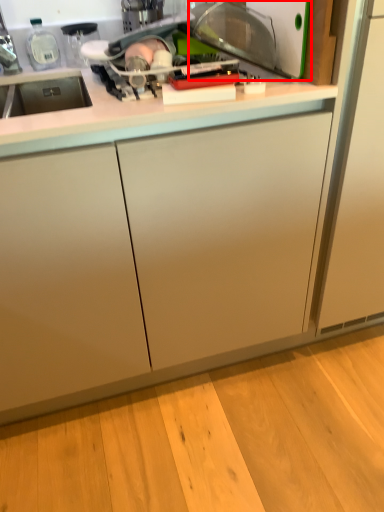
Question: From the image's perspective, considering the relative positions of appliance (annotated by the red box) and countertop in the image provided, where is appliance (annotated by the red box) located with respect to the staircase?

Choices:
 (A) below
 (B) above

Answer: (B)